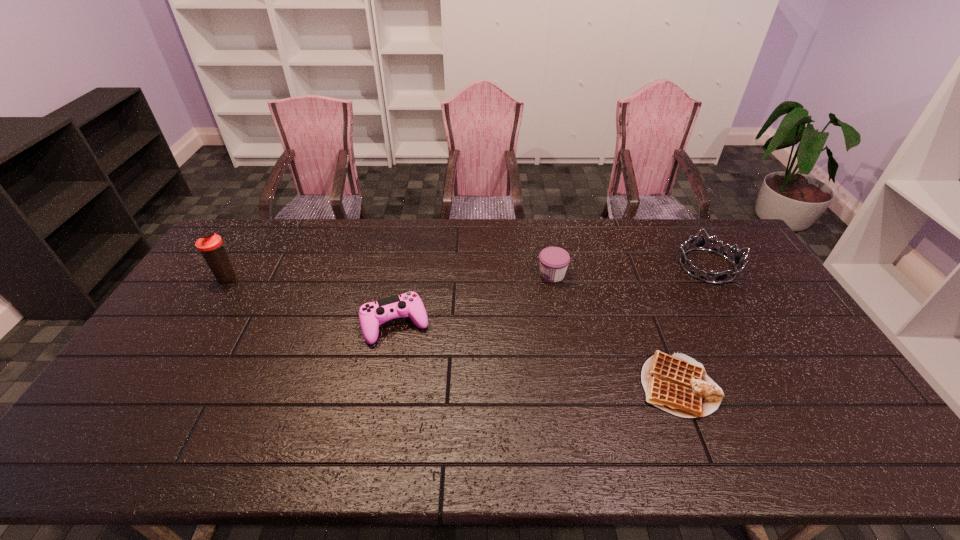
This screenshot has width=960, height=540. Find the location of `vacant point located between the second object from right to left and the third object from right to left`. vacant point located between the second object from right to left and the third object from right to left is located at coordinates 615,330.

The width and height of the screenshot is (960, 540). Identify the location of free space between the second object from left to right and the tallest object. (312, 301).

Where is `vacant region between the third object from right to left and the tiara`? Image resolution: width=960 pixels, height=540 pixels. vacant region between the third object from right to left and the tiara is located at coordinates (630, 271).

Where is `empty location between the leftmost object and the tiara`? Image resolution: width=960 pixels, height=540 pixels. empty location between the leftmost object and the tiara is located at coordinates (468, 272).

Locate an element on the screen. vacant region between the control and the rightmost object is located at coordinates (552, 295).

Find the location of a particular element. This screenshot has height=540, width=960. object that can be found as the second closest to the third object from right to left is located at coordinates (371, 314).

The image size is (960, 540). I want to click on object that can be found as the second closest to the waffle, so click(554, 261).

Where is `free space that satisfies the following two spatial constraints: 1. on the front side of the tallest object; 2. on the right side of the second object from left to right`? The width and height of the screenshot is (960, 540). free space that satisfies the following two spatial constraints: 1. on the front side of the tallest object; 2. on the right side of the second object from left to right is located at coordinates (198, 325).

Locate an element on the screen. vacant space that satisfies the following two spatial constraints: 1. on the front label of the shortest object; 2. on the right side of the third object from right to left is located at coordinates (572, 386).

Image resolution: width=960 pixels, height=540 pixels. Find the location of `vacant space that satisfies the following two spatial constraints: 1. on the front label of the third object from right to left; 2. on the front side of the control`. vacant space that satisfies the following two spatial constraints: 1. on the front label of the third object from right to left; 2. on the front side of the control is located at coordinates (562, 325).